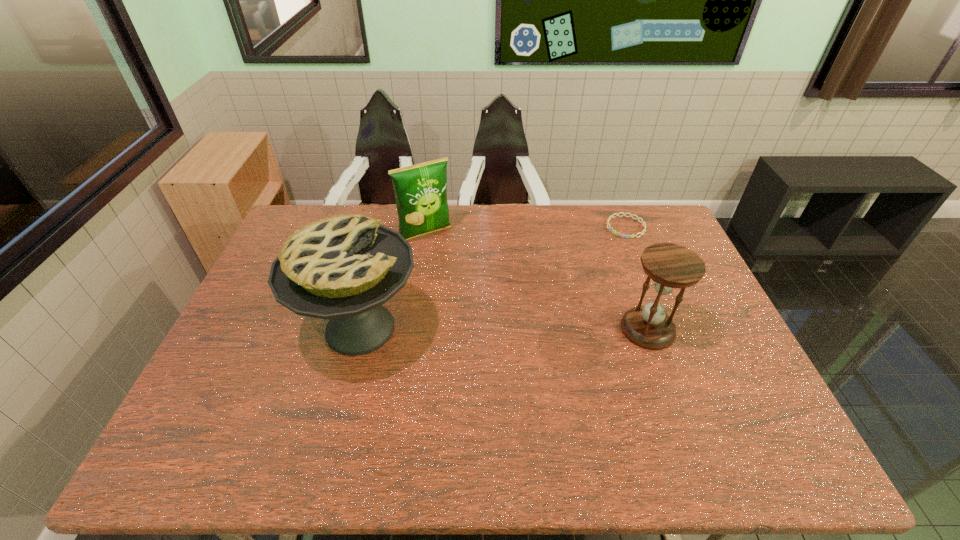
In the image, there is a desktop. Identify the location of free space at the far left corner. (338, 208).

At what (x,y) coordinates should I click in order to perform the action: click on vacant area at the near left corner of the desktop. Please return your answer as a coordinate pair (x, y). Looking at the image, I should click on (205, 415).

This screenshot has height=540, width=960. In order to click on free space between the hourglass and the crisp (potato chip) in this screenshot , I will do `click(537, 282)`.

The width and height of the screenshot is (960, 540). I want to click on free space between the pie and the bracelet, so click(493, 278).

Locate an element on the screen. The width and height of the screenshot is (960, 540). free space between the crisp (potato chip) and the bracelet is located at coordinates (526, 231).

At what (x,y) coordinates should I click in order to perform the action: click on free area in between the shortest object and the hourglass. Please return your answer as a coordinate pair (x, y). This screenshot has width=960, height=540. Looking at the image, I should click on (636, 278).

The height and width of the screenshot is (540, 960). I want to click on empty location between the hourglass and the shortest object, so click(x=636, y=278).

The height and width of the screenshot is (540, 960). I want to click on free space between the shortest object and the pie, so click(x=493, y=278).

Where is `empty space that is in between the pie and the hourglass`? Image resolution: width=960 pixels, height=540 pixels. empty space that is in between the pie and the hourglass is located at coordinates (504, 329).

Locate an element on the screen. empty location between the hourglass and the bracelet is located at coordinates (636, 278).